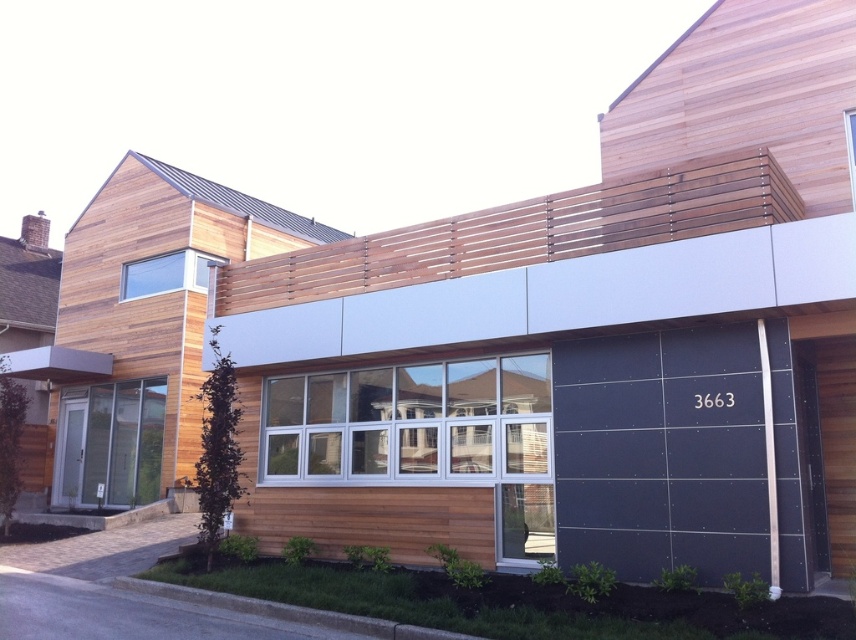
Question: Does dark gray matte/glossy garage door at lower right appear on the left side of matte gray glass door at lower left?

Choices:
 (A) no
 (B) yes

Answer: (A)

Question: Does dark gray matte/glossy garage door at lower right have a lesser width compared to matte gray glass door at lower left?

Choices:
 (A) no
 (B) yes

Answer: (B)

Question: Is dark gray matte/glossy garage door at lower right below matte gray glass door at lower left?

Choices:
 (A) no
 (B) yes

Answer: (A)

Question: Which of the following is the closest to the observer?

Choices:
 (A) matte gray glass door at lower left
 (B) dark gray matte/glossy garage door at lower right

Answer: (B)

Question: Which object is farther from the camera taking this photo?

Choices:
 (A) dark gray matte/glossy garage door at lower right
 (B) matte gray glass door at lower left

Answer: (B)